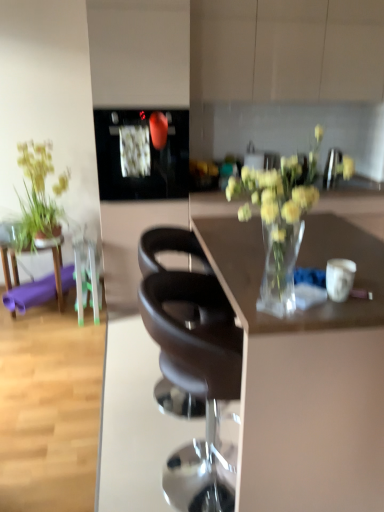
Locate an element on the screen. vacant space that is in between purple rubber mat at left and black leather chair at center, the second chair when ordered from front to back is located at coordinates (94, 353).